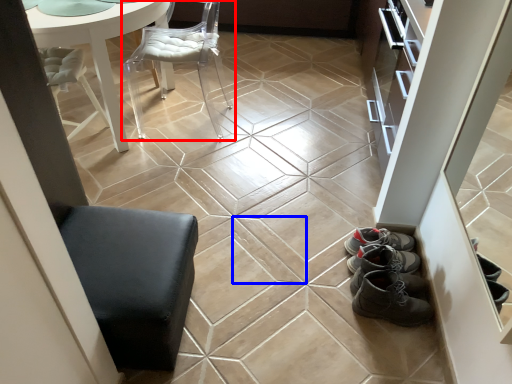
Question: Which object is closer to the camera taking this photo, chair (highlighted by a red box) or ceramic tile (highlighted by a blue box)?

Choices:
 (A) chair
 (B) ceramic tile

Answer: (B)